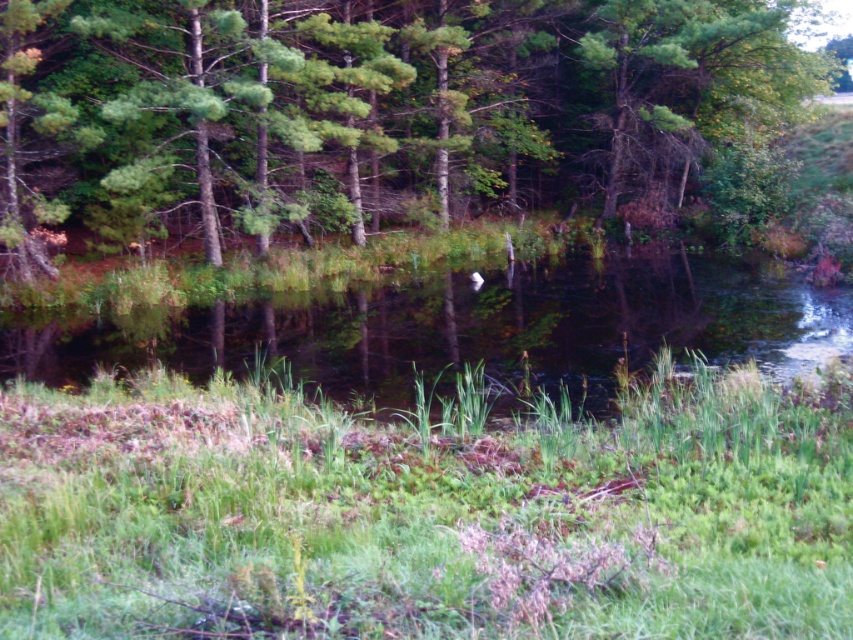
You are standing at the point with coordinates point (656,292) and want to walk to the point with coordinates point (42,152). Which direction should you move in to reach your destination?

To reach point (42,152) from point (656,292), you should move towards the northwest since point (42,152) is located to the northwest of point (656,292).

You are standing at the edge of the water in the scene. You want to walk to the green leafy tree at center. Which direction should you head towards?

To reach the green leafy tree at center, you should head towards the center of the scene from your current position at the water edge.